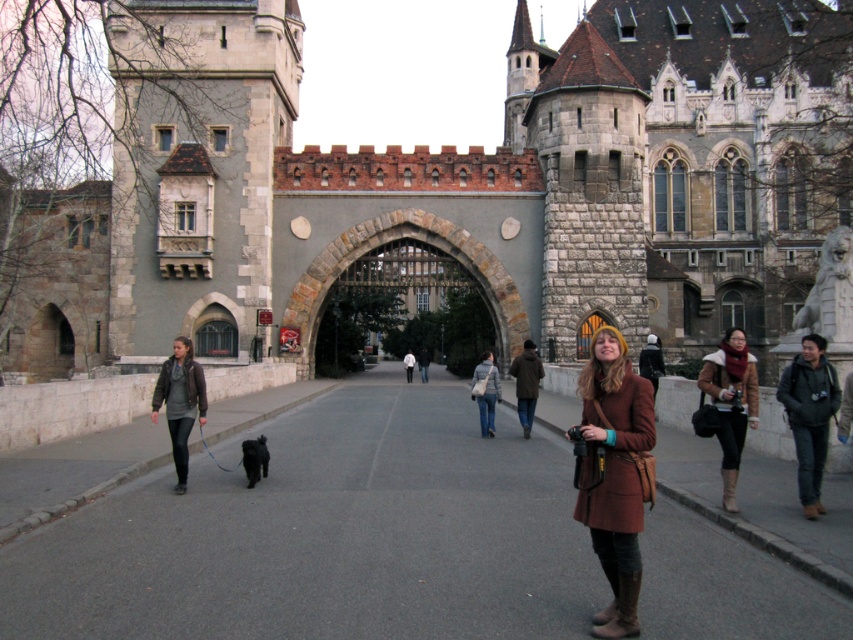
What do you see at coordinates (809, 416) in the screenshot?
I see `dark gray jacket at right` at bounding box center [809, 416].

Does dark gray jacket at right appear under brown fuzzy coat at right?

Correct, dark gray jacket at right is located below brown fuzzy coat at right.

Image resolution: width=853 pixels, height=640 pixels. I want to click on dark gray jacket at right, so click(809, 416).

Is point (728, 419) in front of point (184, 483)?

Yes.

Is brown fuzzy coat at right bigger than matte brown jacket at left?

Indeed, brown fuzzy coat at right has a larger size compared to matte brown jacket at left.

Is point (721, 406) positioned after point (177, 468)?

No, it is in front of (177, 468).

The height and width of the screenshot is (640, 853). I want to click on brown fuzzy coat at right, so click(x=730, y=403).

Can you confirm if stone castle at center is smaller than blue jeans at center?

Actually, stone castle at center might be larger than blue jeans at center.

Who is more distant from viewer, (752, 100) or (486, 408)?

The point (752, 100) is more distant.

This screenshot has width=853, height=640. What do you see at coordinates (451, 189) in the screenshot?
I see `stone castle at center` at bounding box center [451, 189].

At what (x,y) coordinates should I click in order to perform the action: click on stone castle at center. Please return your answer as a coordinate pair (x, y). The image size is (853, 640). Looking at the image, I should click on (451, 189).